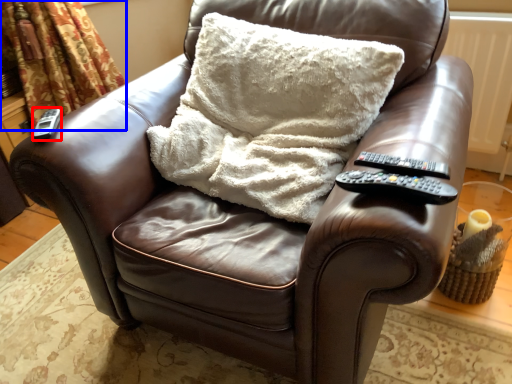
Question: Which point is further to the camera, remote (highlighted by a red box) or curtain (highlighted by a blue box)?

Choices:
 (A) remote
 (B) curtain

Answer: (B)